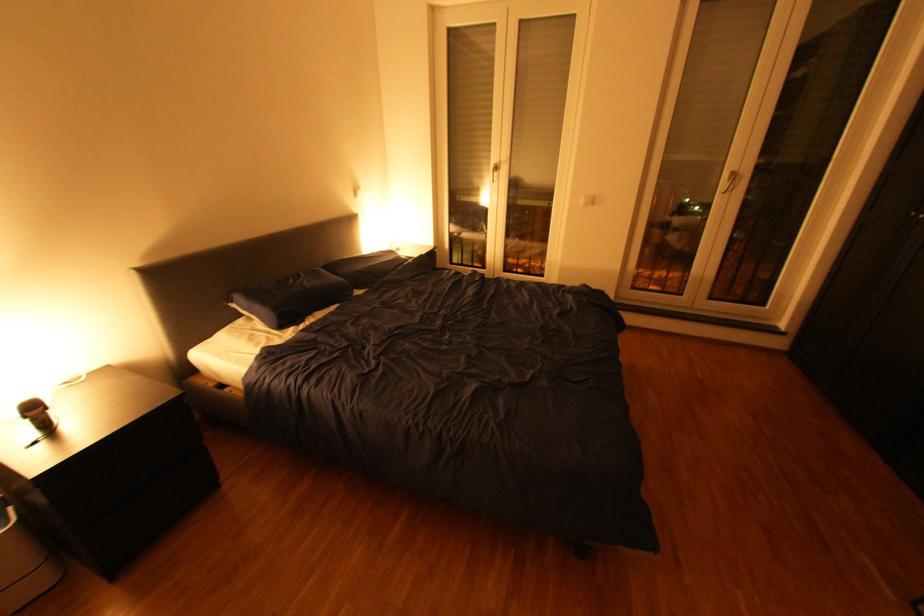
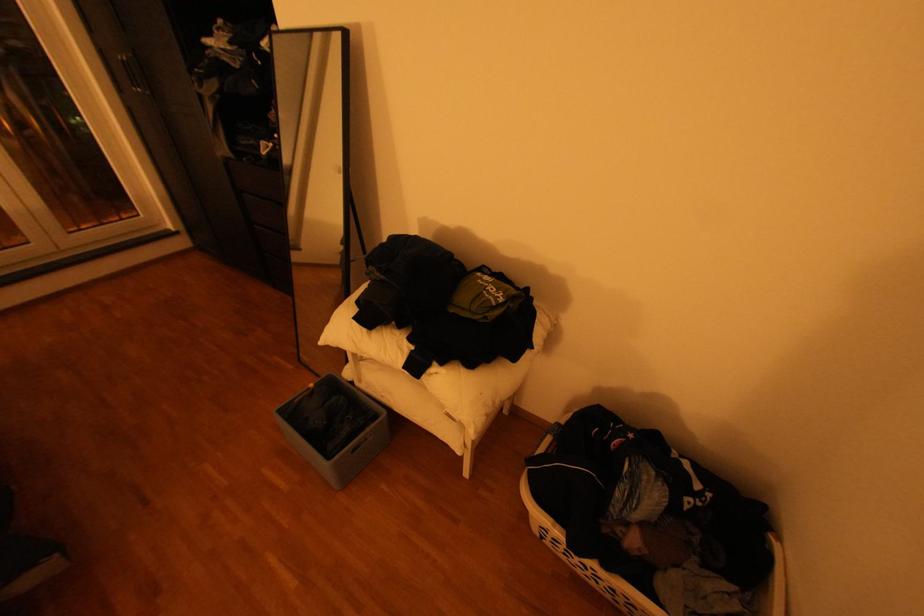
Consider the image. Based on the continuous images, in which direction is the camera rotating?

The camera rotated toward right-down.